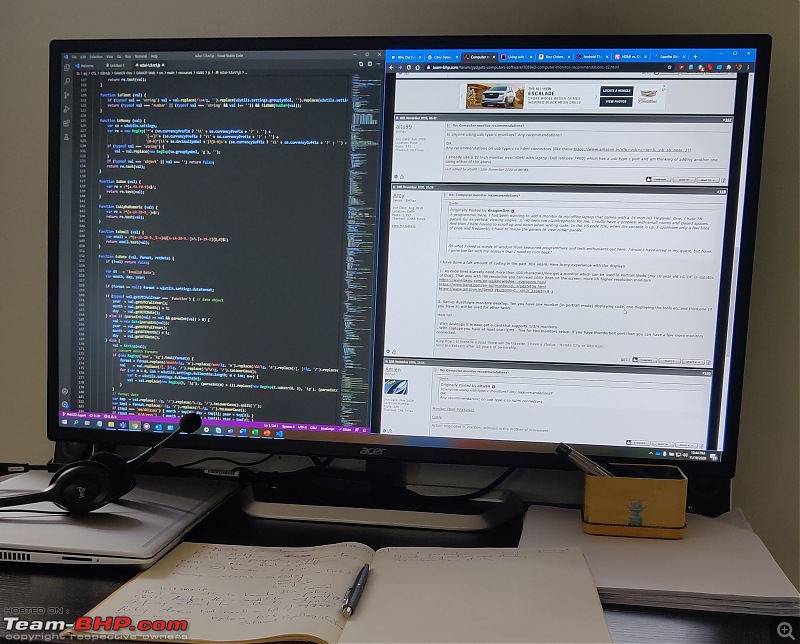
This screenshot has height=644, width=800. Find the location of `laptop`. laptop is located at coordinates (92, 527).